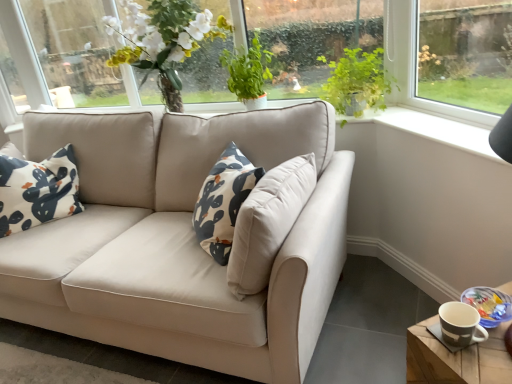
The image size is (512, 384). I want to click on vacant space situated on the left part of matte brown mug at lower right, so point(434,342).